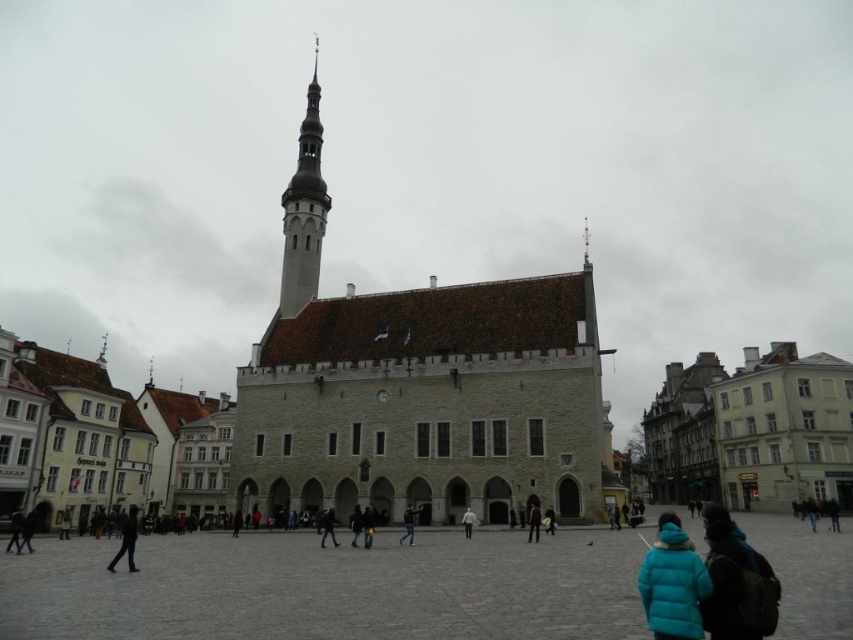
Who is positioned more to the left, teal down jacket at lower right or blue down jacket at center?

From the viewer's perspective, blue down jacket at center appears more on the left side.

Describe the element at coordinates (672, 582) in the screenshot. The width and height of the screenshot is (853, 640). I see `teal down jacket at lower right` at that location.

What are the coordinates of `teal down jacket at lower right` in the screenshot? It's located at (672, 582).

Between smooth stone square at center and black fabric person at center, which one appears on the left side from the viewer's perspective?

black fabric person at center is more to the left.

Is smooth stone square at center shorter than black fabric person at center?

No.

What do you see at coordinates (331, 588) in the screenshot? I see `smooth stone square at center` at bounding box center [331, 588].

Identify the location of smooth stone square at center. The image size is (853, 640). (331, 588).

Is the position of teal down jacket at lower right more distant than that of white matte jacket at center?

No, teal down jacket at lower right is closer to the viewer.

Image resolution: width=853 pixels, height=640 pixels. In order to click on teal down jacket at lower right in this screenshot , I will do `click(672, 582)`.

Image resolution: width=853 pixels, height=640 pixels. I want to click on teal down jacket at lower right, so click(672, 582).